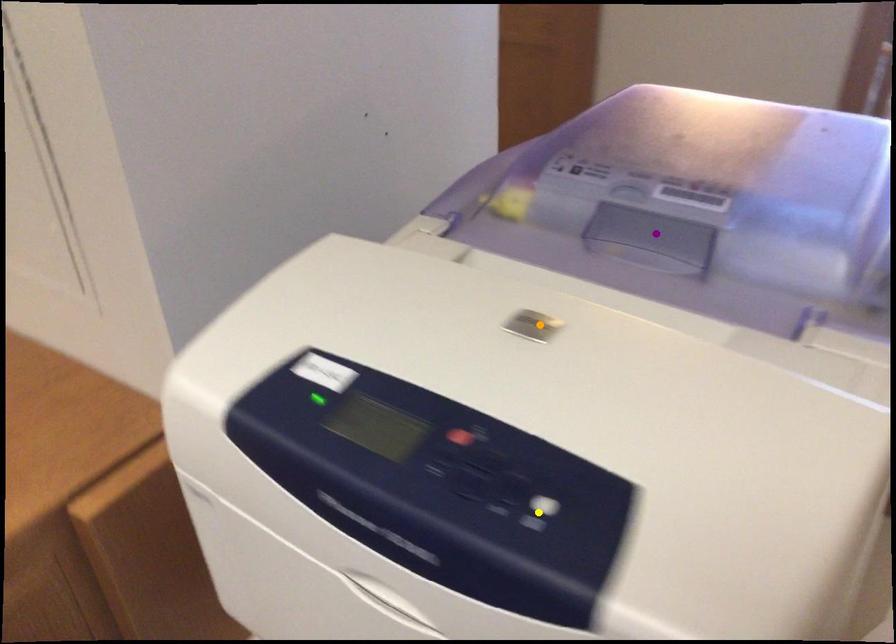
Order these from farthest to nearest:
orange point
purple point
yellow point

purple point, orange point, yellow point